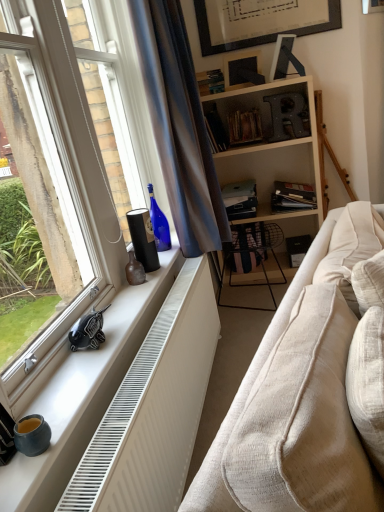
Image resolution: width=384 pixels, height=512 pixels. What do you see at coordinates (241, 70) in the screenshot? I see `wooden picture frame at upper center` at bounding box center [241, 70].

Locate an element on the screen. This screenshot has height=512, width=384. satin blue curtain at window is located at coordinates (179, 126).

In order to face white textured radiator at lower left, should I rotate leftwards or rightwards?

Turn left approximately 2.306 degrees to face it.

The image size is (384, 512). What do you see at coordinates (292, 196) in the screenshot?
I see `black matte book at center, the second book when ordered from bottom to top` at bounding box center [292, 196].

Where is `wooden picture frame at upper center`? The width and height of the screenshot is (384, 512). wooden picture frame at upper center is located at coordinates (241, 70).

Is black matte book at center, the second book when ordered from bottom to top, not close to hardcover book at center, arranged as the third book when viewed from the top?

They are positioned close to each other.

Can you tell me how much black matte book at center, the second book when ordered from bottom to top, and hardcover book at center, marked as the third book in a bottom-to-top arrangement, differ in facing direction?

The facing directions of black matte book at center, the second book when ordered from bottom to top, and hardcover book at center, marked as the third book in a bottom-to-top arrangement, are 0.000719 degrees apart.

Which object is more forward, black matte book at center, the fourth book from the top, or hardcover book at center, arranged as the third book when viewed from the top?

Positioned in front is hardcover book at center, arranged as the third book when viewed from the top.

Does point (309, 204) come behind point (219, 116)?

No, (309, 204) is closer to viewer.

Who is smaller, hardcover book at center, the fourth book from the bottom, or beige fabric couch at lower right?

hardcover book at center, the fourth book from the bottom, is smaller.

Identify the location of studio couch lying below the hardcover book at center, the fourth book from the bottom (from the image's perspective). (252, 385).

Between hardcover book at center, which appears as the 2th book when viewed from the top, and beige fabric couch at lower right, which one appears on the left side from the viewer's perspective?

hardcover book at center, which appears as the 2th book when viewed from the top, is more to the left.

From the image's perspective, which one is positioned higher, white textured radiator at lower left or satin blue curtain at window?

From the image's view, satin blue curtain at window is above.

From a real-world perspective, is white textured radiator at lower left physically located above or below satin blue curtain at window?

white textured radiator at lower left is situated lower than satin blue curtain at window in the real world.

From the picture: Does white textured radiator at lower left have a lesser width compared to satin blue curtain at window?

Indeed, white textured radiator at lower left has a lesser width compared to satin blue curtain at window.

Considering their positions, is wooden picture frame at upper center located in front of or behind matte black bookshelf at center, positioned as the 1th book in bottom-to-top order?

Visually, wooden picture frame at upper center is located in front of matte black bookshelf at center, positioned as the 1th book in bottom-to-top order.

Is wooden picture frame at upper center aimed at matte black bookshelf at center, which is counted as the 5th book, starting from the top?

No, wooden picture frame at upper center does not turn towards matte black bookshelf at center, which is counted as the 5th book, starting from the top.

From the image's perspective, is wooden picture frame at upper center below matte black bookshelf at center, which is counted as the 5th book, starting from the top?

Incorrect, from the image's perspective, wooden picture frame at upper center is higher than matte black bookshelf at center, which is counted as the 5th book, starting from the top.

Does wooden picture frame at upper center have a greater height compared to matte black bookshelf at center, which is counted as the 5th book, starting from the top?

Yes, wooden picture frame at upper center is taller than matte black bookshelf at center, which is counted as the 5th book, starting from the top.

From the image's perspective, which is below, hardcover book at center, arranged as the third book when viewed from the top, or satin blue curtain at window?

satin blue curtain at window is shown below in the image.

Considering the positions of objects hardcover book at center, marked as the third book in a bottom-to-top arrangement, and satin blue curtain at window in the image provided, who is more to the left, hardcover book at center, marked as the third book in a bottom-to-top arrangement, or satin blue curtain at window?

From the viewer's perspective, satin blue curtain at window appears more on the left side.

Which object is thinner, hardcover book at center, arranged as the third book when viewed from the top, or satin blue curtain at window?

Thinner between the two is hardcover book at center, arranged as the third book when viewed from the top.

What's the angular difference between hardcover book at center, marked as the third book in a bottom-to-top arrangement, and satin blue curtain at window's facing directions?

83.8 degrees.

From a real-world perspective, is wooden picture frame at upper center located higher than hardcover book at center, arranged as the third book when viewed from the top?

Yes, from a real-world perspective, wooden picture frame at upper center is above hardcover book at center, arranged as the third book when viewed from the top.

Is wooden picture frame at upper center turned away from hardcover book at center, arranged as the third book when viewed from the top?

wooden picture frame at upper center does not have its back to hardcover book at center, arranged as the third book when viewed from the top.

Considering the positions of objects wooden picture frame at upper center and hardcover book at center, marked as the third book in a bottom-to-top arrangement, in the image provided, who is behind, wooden picture frame at upper center or hardcover book at center, marked as the third book in a bottom-to-top arrangement,?

hardcover book at center, marked as the third book in a bottom-to-top arrangement.

Visually, is wooden picture frame at upper center positioned to the left or to the right of hardcover book at center, arranged as the third book when viewed from the top?

Based on their positions, wooden picture frame at upper center is located to the right of hardcover book at center, arranged as the third book when viewed from the top.

From the image's perspective, is wooden picture frame at upper center positioned above or below brown matte vase at window sill?

wooden picture frame at upper center is situated higher than brown matte vase at window sill in the image.

Considering the sizes of wooden picture frame at upper center and brown matte vase at window sill in the image, is wooden picture frame at upper center bigger or smaller than brown matte vase at window sill?

Clearly, wooden picture frame at upper center is larger in size than brown matte vase at window sill.

Is the depth of wooden picture frame at upper center less than that of brown matte vase at window sill?

No.

Where is `book that is the 2nd object directly below the hardcover book at center, marked as the third book in a bottom-to-top arrangement (from a real-world perspective)`? This screenshot has height=512, width=384. book that is the 2nd object directly below the hardcover book at center, marked as the third book in a bottom-to-top arrangement (from a real-world perspective) is located at coordinates (292, 196).

At what (x,y) coordinates should I click in order to perform the action: click on book that is the 4th object located above the beige fabric couch at lower right (from the image's perspective). Please return your answer as a coordinate pair (x, y). This screenshot has width=384, height=512. Looking at the image, I should click on (244, 127).

Which object lies nearer to the anchor point brown matte vase at window sill, hardcover book at upper center, positioned as the 5th book in bottom-to-top order, or hardcover book at center, marked as the third book in a bottom-to-top arrangement?

hardcover book at upper center, positioned as the 5th book in bottom-to-top order, is positioned closer to the anchor brown matte vase at window sill.

From the image, which object appears to be nearer to hardcover book at upper center, which is counted as the first book, starting from the top, wooden picture frame at upper center or beige fabric couch at lower right?

wooden picture frame at upper center is closer to hardcover book at upper center, which is counted as the first book, starting from the top.

Based on the photo, when comparing their distances from satin blue curtain at window, does hardcover book at center, the fourth book from the bottom, or hardcover book at upper center, positioned as the 5th book in bottom-to-top order, seem further?

hardcover book at center, the fourth book from the bottom, is positioned further to the anchor satin blue curtain at window.

Considering their positions, is brown matte vase at window sill positioned closer to beige fabric couch at lower right than satin blue curtain at window?

The object closer to beige fabric couch at lower right is brown matte vase at window sill.

Based on their spatial positions, is satin blue curtain at window or hardcover book at center, marked as the third book in a bottom-to-top arrangement, further from matte black bookshelf at center, which is counted as the 5th book, starting from the top?

satin blue curtain at window.

Considering their positions, is satin blue curtain at window positioned further to beige fabric couch at lower right than hardcover book at center, arranged as the third book when viewed from the top?

Based on the image, hardcover book at center, arranged as the third book when viewed from the top, appears to be further to beige fabric couch at lower right.

Estimate the real-world distances between objects in this image. Which object is closer to hardcover book at upper center, which is counted as the first book, starting from the top, hardcover book at center, arranged as the third book when viewed from the top, or white textured radiator at lower left?

Among the two, hardcover book at center, arranged as the third book when viewed from the top, is located nearer to hardcover book at upper center, which is counted as the first book, starting from the top.

When comparing their distances from hardcover book at upper center, which is counted as the first book, starting from the top, does matte black bookshelf at center, which is counted as the 5th book, starting from the top, or white textured radiator at lower left seem further?

white textured radiator at lower left is further to hardcover book at upper center, which is counted as the first book, starting from the top.

Identify the location of curtain located between white textured radiator at lower left and black matte book at center, the second book when ordered from bottom to top, in the depth direction. This screenshot has height=512, width=384. (179, 126).

Locate an element on the screen. Image resolution: width=384 pixels, height=512 pixels. radiator located between beige fabric couch at lower right and black matte book at center, the fourth book from the top, in the depth direction is located at coordinates (154, 408).

Identify the location of picture frame between beige fabric couch at lower right and hardcover book at center, arranged as the third book when viewed from the top, along the z-axis. [241, 70].

The width and height of the screenshot is (384, 512). In order to click on vase between beige fabric couch at lower right and hardcover book at upper center, which is counted as the first book, starting from the top, from front to back in this screenshot , I will do `click(134, 270)`.